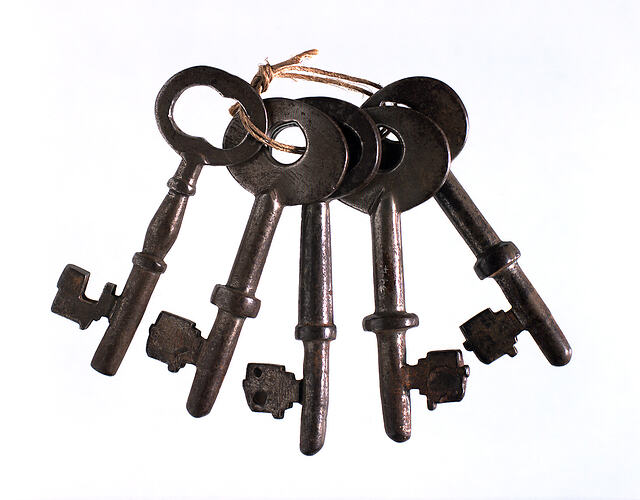
You are a GUI agent. You are given a task and a screenshot of the screen. Output one action in this format:
    pyautogui.click(x=<x>, y=<y>)
    Task: Click on the metal key
    The image size is (640, 500).
    Given the screenshot: What is the action you would take?
    pyautogui.click(x=316, y=407)